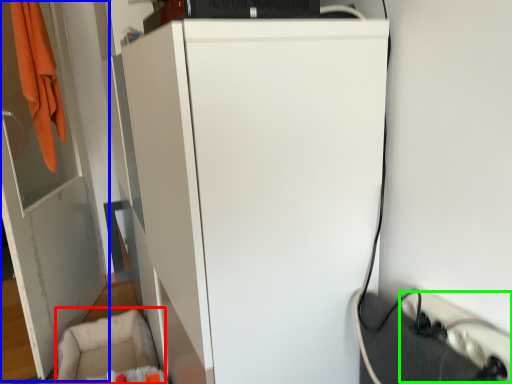
Question: Which object is positioned farthest from swivel chair (highlighted by a red box)? Select from door (highlighted by a blue box) and extension cord (highlighted by a green box).

Choices:
 (A) door
 (B) extension cord

Answer: (B)